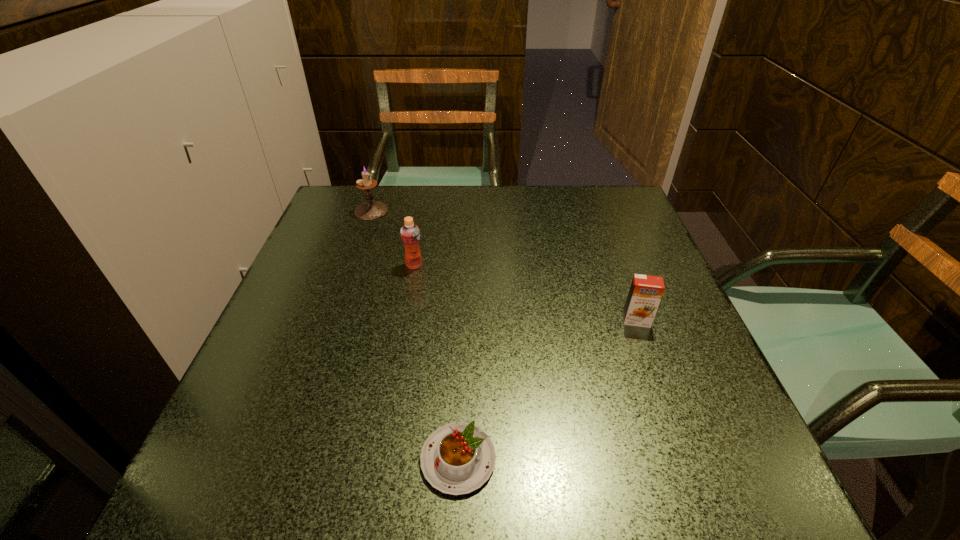
The height and width of the screenshot is (540, 960). What are the coordinates of `blank space located 0.380m on the back of the shorter orange juice` in the screenshot? It's located at (596, 211).

Identify the location of free space located on the left of the pudding. (234, 459).

The image size is (960, 540). I want to click on object that is at the far edge, so click(x=371, y=210).

Locate an element on the screen. This screenshot has height=540, width=960. object at the near edge is located at coordinates (458, 458).

The image size is (960, 540). In order to click on object located in the left edge section of the desktop in this screenshot , I will do `click(371, 210)`.

The width and height of the screenshot is (960, 540). Identify the location of object located at the right edge. (646, 291).

Locate an element on the screen. The image size is (960, 540). object situated at the far left corner is located at coordinates (371, 210).

At what (x,y) coordinates should I click in order to perform the action: click on vacant space at the far edge of the desktop. Please return your answer as a coordinate pair (x, y). Looking at the image, I should click on (528, 186).

Where is `free location at the near edge of the desktop`? Image resolution: width=960 pixels, height=540 pixels. free location at the near edge of the desktop is located at coordinates (543, 472).

This screenshot has height=540, width=960. In order to click on vacant region at the left edge in this screenshot , I will do `click(254, 418)`.